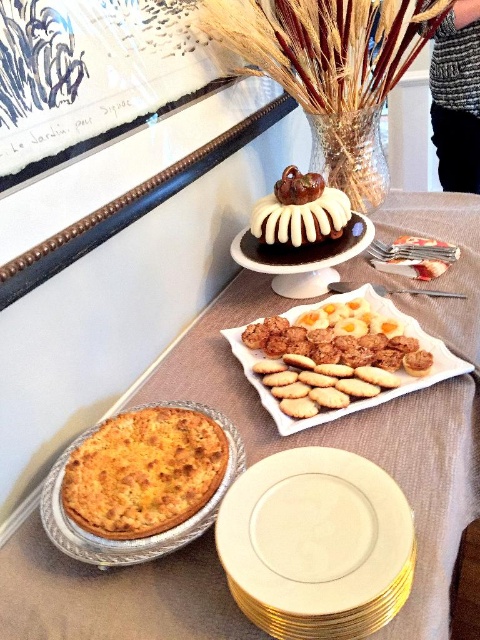
You are a baker who needs to place a 12 inch cake platter between the shiny aluminum pie tin at lower left and the white glazed cake at center. Is there enough space?

The shiny aluminum pie tin at lower left and white glazed cake at center are 10.54 inches apart, so the space between them is not enough to fit a 12 inch cake platter.

You are a guest at a party and want to reach for a cookie from the white porcelain plate at center without knocking over the golden aluminum pie at lower left. Considering their heights, which one should you be cautious about bumping into while reaching?

The golden aluminum pie at lower left is taller than the white porcelain plate at center, so you should be cautious about bumping into the golden aluminum pie at lower left while reaching for the cookies.